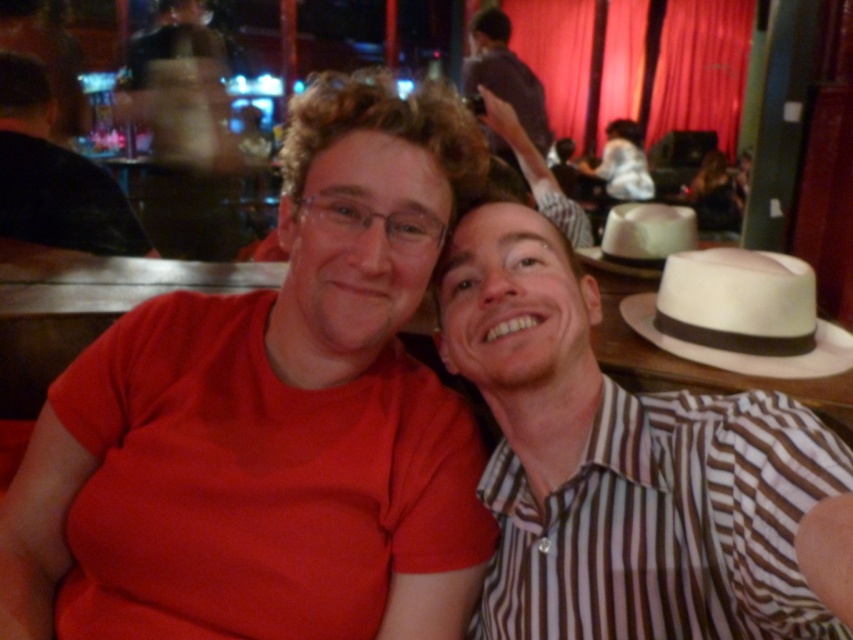
Can you confirm if striped cotton shirt at right is smaller than white felt cowboy hat at right?

No.

Which of these two, striped cotton shirt at right or white felt cowboy hat at right, stands shorter?

Standing shorter between the two is white felt cowboy hat at right.

Which is behind, point (636, 566) or point (753, 340)?

The point (753, 340) is more distant.

Where is `striped cotton shirt at right`? striped cotton shirt at right is located at coordinates click(621, 465).

Does matte red shirt at center have a lesser width compared to white felt cowboy hat at right?

No, matte red shirt at center is not thinner than white felt cowboy hat at right.

Which is more to the right, matte red shirt at center or white felt cowboy hat at right?

From the viewer's perspective, white felt cowboy hat at right appears more on the right side.

In order to click on matte red shirt at center in this screenshot , I will do `click(299, 374)`.

Identify the location of matte red shirt at center. The height and width of the screenshot is (640, 853). (299, 374).

Is white felt cowboy hat at right above dark purple shirt at upper center?

No.

Is point (697, 257) less distant than point (491, 10)?

That is True.

The height and width of the screenshot is (640, 853). What are the coordinates of `white felt cowboy hat at right` in the screenshot? It's located at (x=740, y=314).